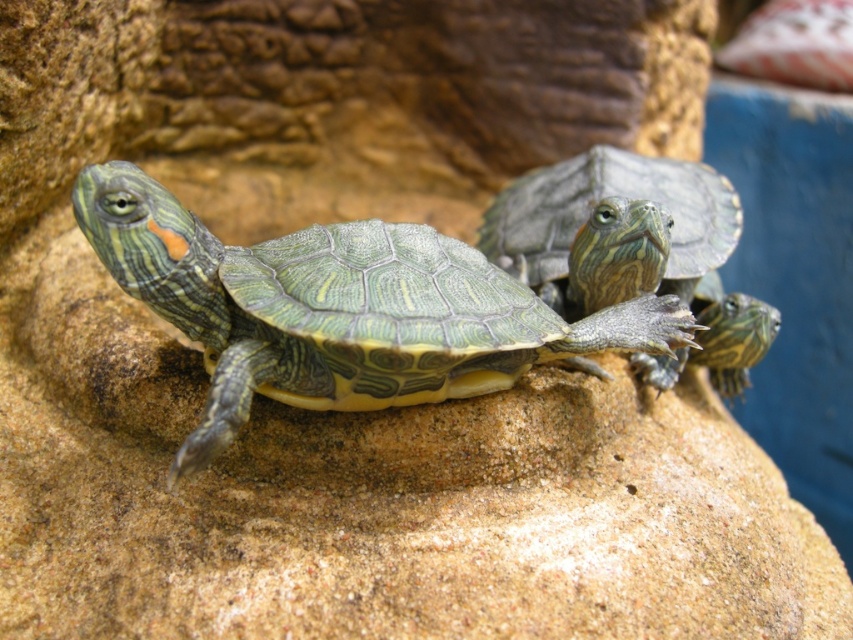
Question: Is green scaly turtle at center thinner than green textured shell at center?

Choices:
 (A) yes
 (B) no

Answer: (B)

Question: Does green scaly turtle at center lie behind green textured shell at center?

Choices:
 (A) yes
 (B) no

Answer: (B)

Question: Where is green scaly turtle at center located in relation to green textured shell at center in the image?

Choices:
 (A) above
 (B) below

Answer: (B)